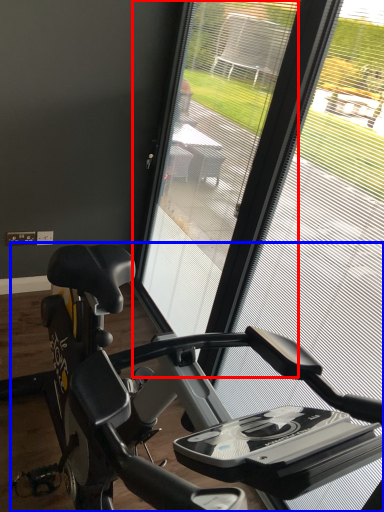
Question: Which of the following is the closest to the observer, screen door (highlighted by a red box) or stationary bicycle (highlighted by a blue box)?

Choices:
 (A) screen door
 (B) stationary bicycle

Answer: (B)